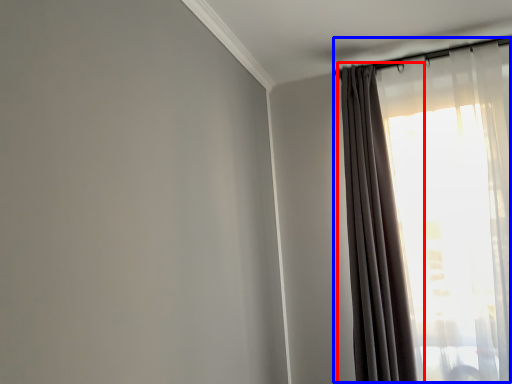
Question: Which object is closer to the camera taking this photo, curtain (highlighted by a red box) or curtain (highlighted by a blue box)?

Choices:
 (A) curtain
 (B) curtain

Answer: (A)